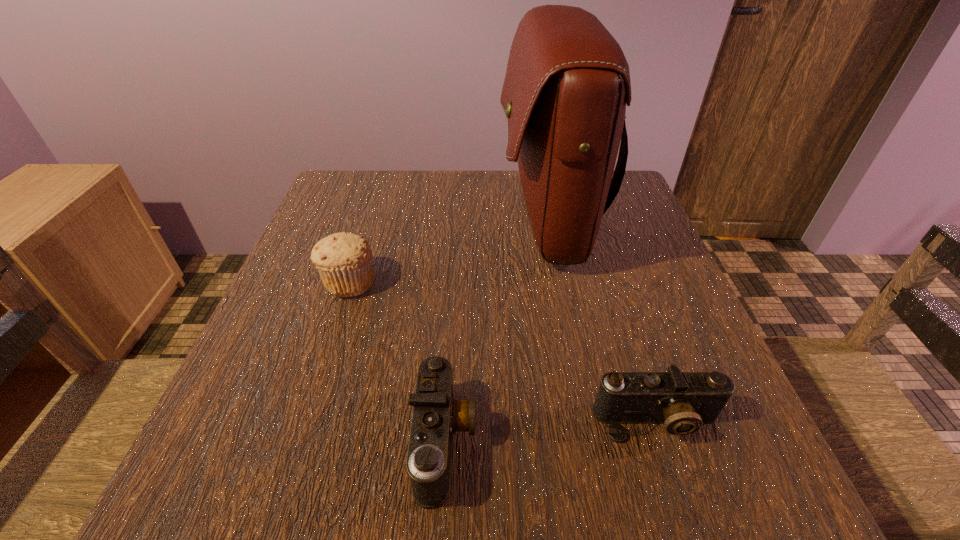
Identify the location of satchel. (567, 83).

Find the location of a particular element. the third shortest object is located at coordinates (344, 261).

Locate an element on the screen. The image size is (960, 540). muffin is located at coordinates click(344, 261).

Image resolution: width=960 pixels, height=540 pixels. I want to click on the right camera, so click(683, 401).

This screenshot has height=540, width=960. In order to click on the third object from right to left in this screenshot , I will do `click(437, 415)`.

I want to click on free spot located 0.230m on the open flap of the tallest object, so click(402, 221).

Where is `free spot located on the open flap of the tallest object`? This screenshot has height=540, width=960. free spot located on the open flap of the tallest object is located at coordinates (395, 221).

I want to click on free spot located 0.050m on the open flap of the tallest object, so click(478, 221).

Image resolution: width=960 pixels, height=540 pixels. Find the location of `vacant space located on the back of the second tallest object`. vacant space located on the back of the second tallest object is located at coordinates (380, 188).

I want to click on free region located on the front-facing side of the right camera, so click(681, 495).